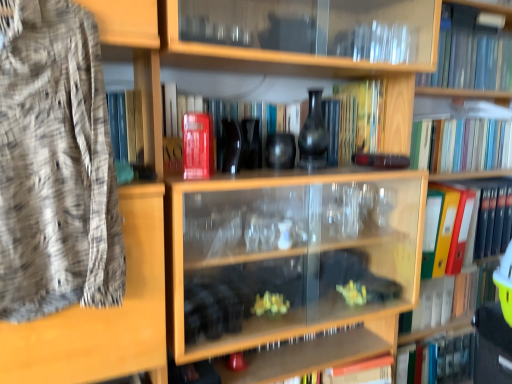
Locate an element on the screen. The height and width of the screenshot is (384, 512). yellow plastic folder at right, which is the 1th book in bottom-to-top order is located at coordinates (450, 298).

At what (x,y) coordinates should I click in order to perform the action: click on multicolored hardcover books at upper right, placed as the 5th book when sorted from bottom to top. Please return your answer as a coordinate pair (x, y). Image resolution: width=512 pixels, height=384 pixels. Looking at the image, I should click on (461, 144).

Describe the element at coordinates (198, 146) in the screenshot. I see `red matte book at upper center, the third book from the bottom` at that location.

Where is `transparent glass cabinet at lower center`? The height and width of the screenshot is (384, 512). transparent glass cabinet at lower center is located at coordinates (309, 353).

The width and height of the screenshot is (512, 384). What do you see at coordinates (470, 54) in the screenshot?
I see `transparent glass book at upper right, the 1th book positioned from the top` at bounding box center [470, 54].

Find the location of a particular element. matte black vase at center is located at coordinates (313, 135).

Considering the positions of objects orange file folder at right, the second book ordered from the bottom, and transparent glass cabinet at lower center in the image provided, who is more to the left, orange file folder at right, the second book ordered from the bottom, or transparent glass cabinet at lower center?

transparent glass cabinet at lower center.

Identify the location of cabinet below the orange file folder at right, which ranks as the 6th book in top-to-bottom order (from the image's perspective). Image resolution: width=512 pixels, height=384 pixels. (309, 353).

Is orange file folder at right, which ranks as the 6th book in top-to-bottom order, positioned with its back to transparent glass cabinet at lower center?

No, orange file folder at right, which ranks as the 6th book in top-to-bottom order, is not facing the opposite direction of transparent glass cabinet at lower center.

Is point (505, 235) more distant than point (302, 372)?

Yes, it is behind point (302, 372).

Is orange file folder at right, the second book ordered from the bottom, behind yellow matte book at center, the 6th book ordered from the bottom?

Yes, orange file folder at right, the second book ordered from the bottom, is further from the camera.

What's the angular difference between orange file folder at right, which ranks as the 6th book in top-to-bottom order, and yellow matte book at center, the 6th book ordered from the bottom,'s facing directions?

1.13 degrees.

Does orange file folder at right, the second book ordered from the bottom, have a greater height compared to yellow matte book at center, the 6th book ordered from the bottom?

Indeed, orange file folder at right, the second book ordered from the bottom, has a greater height compared to yellow matte book at center, the 6th book ordered from the bottom.

Which is in front, point (496, 212) or point (352, 131)?

Point (352, 131)

Between transparent glass cabinet at lower center and transparent glass book at upper right, the 1th book positioned from the top, which one has smaller width?

Thinner between the two is transparent glass cabinet at lower center.

Is transparent glass cabinet at lower center taller or shorter than transparent glass book at upper right, marked as the seventh book in a bottom-to-top arrangement?

Considering their sizes, transparent glass cabinet at lower center has less height than transparent glass book at upper right, marked as the seventh book in a bottom-to-top arrangement.

Consider the image. Considering the sizes of transparent glass cabinet at lower center and transparent glass book at upper right, the 1th book positioned from the top, in the image, is transparent glass cabinet at lower center bigger or smaller than transparent glass book at upper right, the 1th book positioned from the top,?

transparent glass cabinet at lower center is smaller than transparent glass book at upper right, the 1th book positioned from the top.

Considering the relative sizes of matte red book at center, which ranks as the 4th book in top-to-bottom order, and multicolored hardcover books at upper right, placed as the 5th book when sorted from bottom to top, in the image provided, is matte red book at center, which ranks as the 4th book in top-to-bottom order, taller than multicolored hardcover books at upper right, placed as the 5th book when sorted from bottom to top,?

Correct, matte red book at center, which ranks as the 4th book in top-to-bottom order, is much taller as multicolored hardcover books at upper right, placed as the 5th book when sorted from bottom to top.

Between point (213, 113) and point (469, 155), which one is positioned in front?

Point (213, 113)

From the image's perspective, which is below, matte red book at center, arranged as the 4th book when ordered from the bottom, or multicolored hardcover books at upper right, placed as the 5th book when sorted from bottom to top?

matte red book at center, arranged as the 4th book when ordered from the bottom, is shown below in the image.

In the image, is matte red book at center, which ranks as the 4th book in top-to-bottom order, positioned in front of or behind multicolored hardcover books at upper right, placed as the 5th book when sorted from bottom to top?

In the image, matte red book at center, which ranks as the 4th book in top-to-bottom order, appears in front of multicolored hardcover books at upper right, placed as the 5th book when sorted from bottom to top.

From the image's perspective, is red matte book at upper center, the third book from the bottom, above matte red book at center, which ranks as the 4th book in top-to-bottom order?

No.

Is red matte book at upper center, the third book from the bottom, with matte red book at center, which ranks as the 4th book in top-to-bottom order?

No, red matte book at upper center, the third book from the bottom, is not beside matte red book at center, which ranks as the 4th book in top-to-bottom order.

Can matte red book at center, arranged as the 4th book when ordered from the bottom, be found inside red matte book at upper center, which is counted as the 5th book, starting from the top?

No, matte red book at center, arranged as the 4th book when ordered from the bottom, is not a part of red matte book at upper center, which is counted as the 5th book, starting from the top.

Is point (199, 120) positioned after point (332, 158)?

That is False.

Looking at this image, between red matte book at upper center, the third book from the bottom, and transparent glass cabinet at lower center, which one has smaller width?

red matte book at upper center, the third book from the bottom, is thinner.

Which is in front, red matte book at upper center, the third book from the bottom, or transparent glass cabinet at lower center?

red matte book at upper center, the third book from the bottom, is in front.

From the image's perspective, is red matte book at upper center, which is counted as the 5th book, starting from the top, beneath transparent glass cabinet at lower center?

No, from the image's perspective, red matte book at upper center, which is counted as the 5th book, starting from the top, is not beneath transparent glass cabinet at lower center.

Is yellow plastic folder at right, which is the seventh book from top to bottom, further to camera compared to woven fabric shirt at left?

Yes, it is behind woven fabric shirt at left.

From the image's perspective, which object appears higher, yellow plastic folder at right, which is the 1th book in bottom-to-top order, or woven fabric shirt at left?

woven fabric shirt at left appears higher in the image.

From a real-world perspective, is yellow plastic folder at right, which is the seventh book from top to bottom, under woven fabric shirt at left?

Yes, from a real-world perspective, yellow plastic folder at right, which is the seventh book from top to bottom, is below woven fabric shirt at left.

The height and width of the screenshot is (384, 512). I want to click on the 5th book counting from the right side of the transparent glass cabinet at lower center, so (x=488, y=218).

Locate an element on the screen. This screenshot has width=512, height=384. the 4th book to the left of the orange file folder at right, which ranks as the 6th book in top-to-bottom order, starting your count from the anchor is located at coordinates (360, 118).

Looking at the image, which one is located closer to transparent glass book at upper right, marked as the seventh book in a bottom-to-top arrangement, transparent glass cabinet at lower center or orange file folder at right, the second book ordered from the bottom?

orange file folder at right, the second book ordered from the bottom, is positioned closer to the anchor transparent glass book at upper right, marked as the seventh book in a bottom-to-top arrangement.

When comparing their distances from red matte book at upper center, which is counted as the 5th book, starting from the top, does yellow matte book at center, which is the 2th book from top to bottom, or transparent glass cabinet at lower center seem further?

Among the two, transparent glass cabinet at lower center is located further to red matte book at upper center, which is counted as the 5th book, starting from the top.

From the image, which object appears to be farther from transparent glass book at upper right, marked as the seventh book in a bottom-to-top arrangement, multicolored hardcover books at upper right, the 3th book in the top-to-bottom sequence, or transparent glass bookcase at upper center?

Among the two, transparent glass bookcase at upper center is located further to transparent glass book at upper right, marked as the seventh book in a bottom-to-top arrangement.

When comparing their distances from orange file folder at right, which ranks as the 6th book in top-to-bottom order, does yellow matte book at center, the 6th book ordered from the bottom, or transparent glass book at upper right, the 1th book positioned from the top, seem further?

yellow matte book at center, the 6th book ordered from the bottom, is positioned further to the anchor orange file folder at right, which ranks as the 6th book in top-to-bottom order.

Considering their positions, is multicolored hardcover books at upper right, placed as the 5th book when sorted from bottom to top, positioned closer to yellow matte book at center, which is the 2th book from top to bottom, than transparent glass bookcase at upper center?

Among the two, multicolored hardcover books at upper right, placed as the 5th book when sorted from bottom to top, is located nearer to yellow matte book at center, which is the 2th book from top to bottom.

From the image, which object appears to be farther from woven fabric shirt at left, yellow matte book at center, which is the 2th book from top to bottom, or orange file folder at right, the second book ordered from the bottom?

orange file folder at right, the second book ordered from the bottom.

Estimate the real-world distances between objects in this image. Which object is further from yellow plastic folder at right, which is the seventh book from top to bottom, transparent glass book at upper right, the 1th book positioned from the top, or matte black vase at center?

matte black vase at center lies further to yellow plastic folder at right, which is the seventh book from top to bottom, than the other object.

Considering their positions, is multicolored hardcover books at upper right, the 3th book in the top-to-bottom sequence, positioned closer to woven fabric shirt at left than transparent glass bookcase at upper center?

transparent glass bookcase at upper center is positioned closer to the anchor woven fabric shirt at left.

At what (x,y) coordinates should I click in order to perform the action: click on book positioned between woven fabric shirt at left and matte red book at center, arranged as the 4th book when ordered from the bottom, from near to far. Please return your answer as a coordinate pair (x, y). This screenshot has width=512, height=384. Looking at the image, I should click on (198, 146).

Image resolution: width=512 pixels, height=384 pixels. I want to click on bookcase between yellow matte book at center, which is the 2th book from top to bottom, and multicolored hardcover books at upper right, the 3th book in the top-to-bottom sequence, from left to right, so click(462, 147).

Locate an element on the screen. glass vase between woven fabric shirt at left and orange file folder at right, which ranks as the 6th book in top-to-bottom order, in the horizontal direction is located at coordinates (313, 135).

Locate an element on the screen. Image resolution: width=512 pixels, height=384 pixels. book situated between matte red book at center, which ranks as the 4th book in top-to-bottom order, and transparent glass bookcase at upper center from left to right is located at coordinates [360, 118].